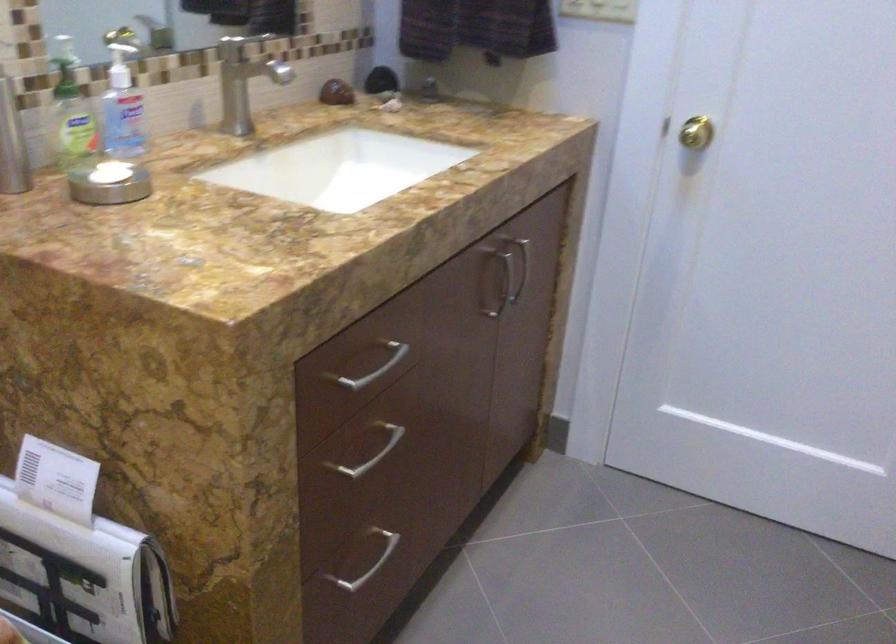
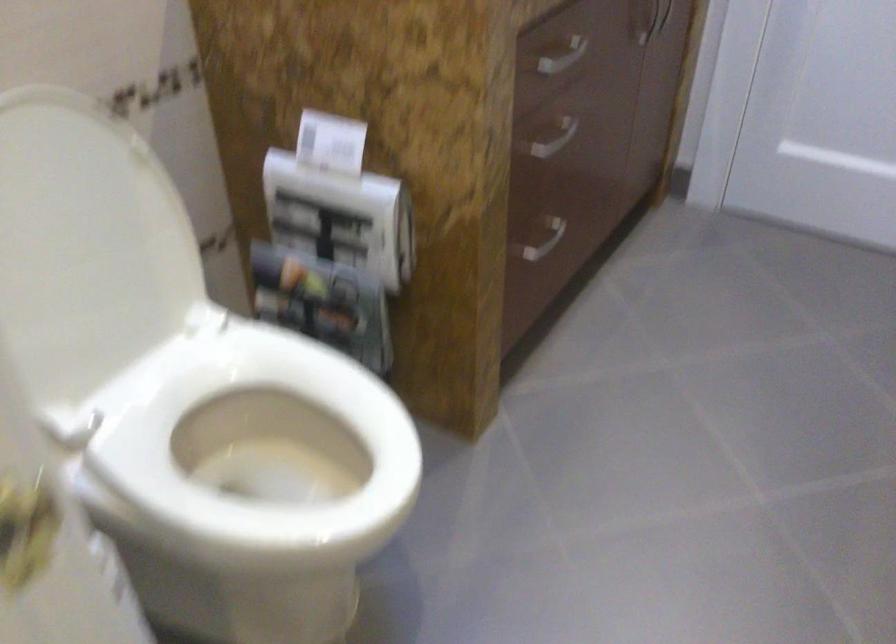
Locate, in the second image, the point that corresponds to (x=363, y=554) in the first image.

(538, 238)